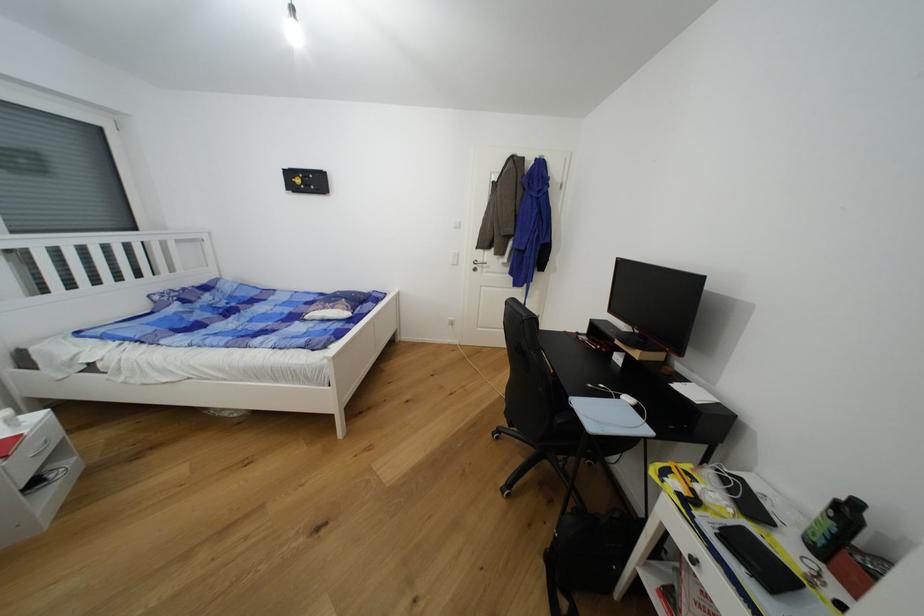
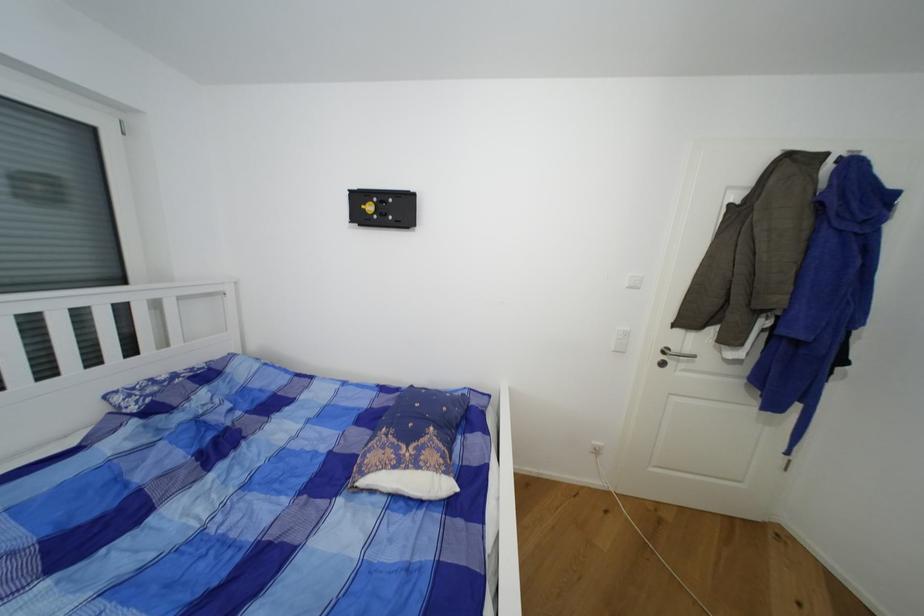
In the second image, find the point that corresponds to (x=353, y=315) in the first image.

(454, 488)